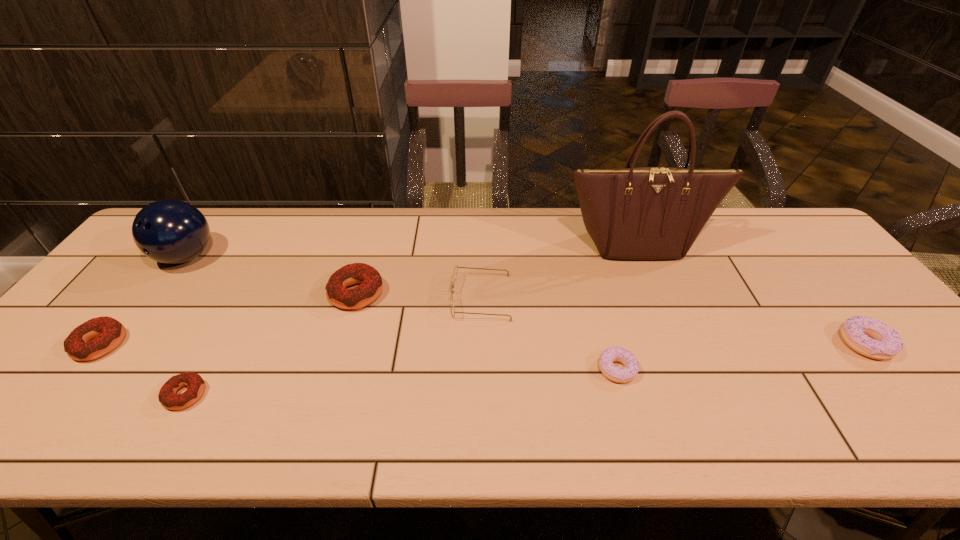
The image size is (960, 540). I want to click on handbag, so click(647, 213).

Locate an element on the screen. The height and width of the screenshot is (540, 960). blue bowling ball is located at coordinates (168, 231).

This screenshot has width=960, height=540. I want to click on bowling ball, so click(168, 231).

Identify the location of the farthest chocolate doughnut. Image resolution: width=960 pixels, height=540 pixels. (371, 285).

You are a GUI agent. You are given a task and a screenshot of the screen. Output one action in this format:
    pyautogui.click(x=<x>, y=<y>)
    Task: Click on the biggest chocolate doughnut
    The height and width of the screenshot is (540, 960).
    Given the screenshot: What is the action you would take?
    pyautogui.click(x=371, y=285)

This screenshot has height=540, width=960. I want to click on spectacles, so click(453, 277).

The width and height of the screenshot is (960, 540). In order to click on beige spectacles in this screenshot , I will do `click(453, 277)`.

In order to click on the bigger purple doughnut in this screenshot , I will do `click(857, 331)`.

Identify the location of the rightmost doughnut. The width and height of the screenshot is (960, 540). (857, 331).

The image size is (960, 540). In order to click on the leftmost doughnut in this screenshot , I will do `click(109, 332)`.